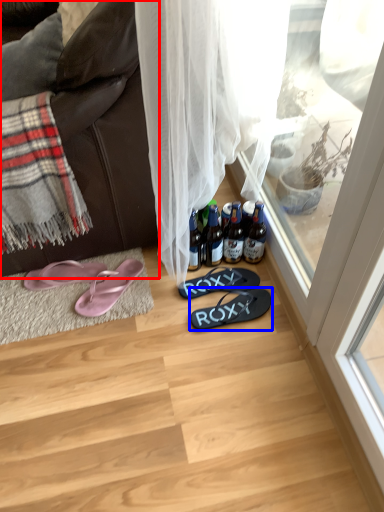
Question: Among these objects, which one is nearest to the camera, studio couch (highlighted by a red box) or footwear (highlighted by a blue box)?

Choices:
 (A) studio couch
 (B) footwear

Answer: (A)